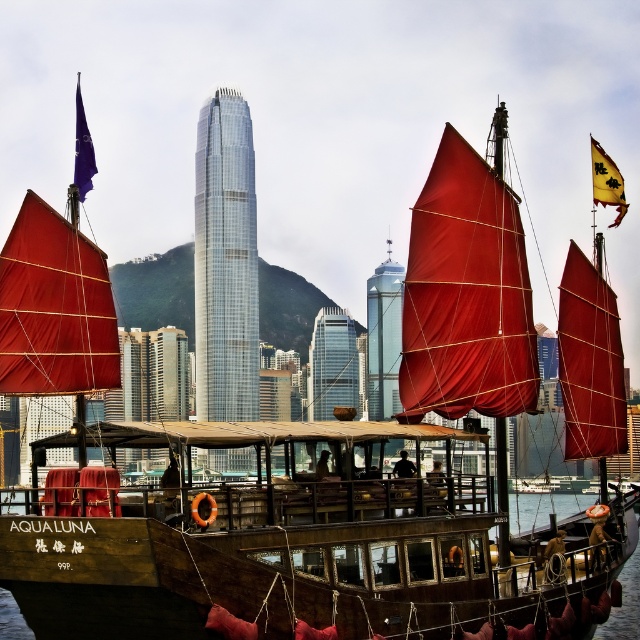
Question: Can you confirm if wooden boat at lower center is positioned to the right of matte red sail at center?

Choices:
 (A) no
 (B) yes

Answer: (A)

Question: Can you confirm if wooden boat at lower center is positioned below matte red sail at center?

Choices:
 (A) yes
 (B) no

Answer: (A)

Question: Which object appears farthest from the camera in this image?

Choices:
 (A) wooden boat at lower center
 (B) matte red sail at center

Answer: (B)

Question: Is wooden boat at lower center below matte red sail at center?

Choices:
 (A) no
 (B) yes

Answer: (B)